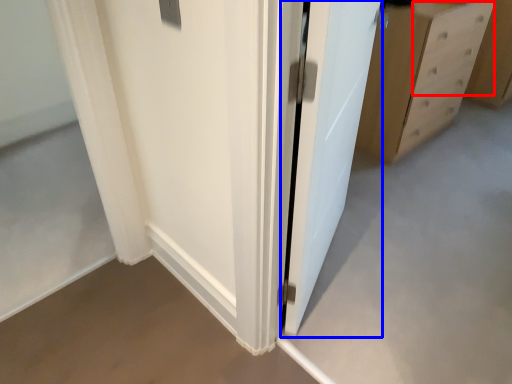
Question: Which point is further to the camera, drawer (highlighted by a red box) or door (highlighted by a blue box)?

Choices:
 (A) drawer
 (B) door

Answer: (A)